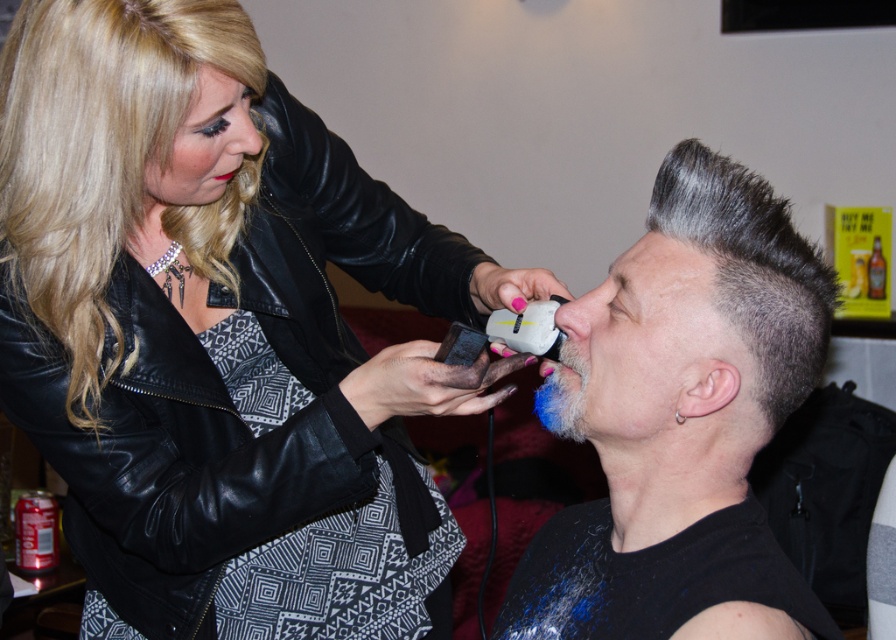
Question: Which object appears farthest from the camera in this image?

Choices:
 (A) pink matte lips at center
 (B) black leather jacket at upper left

Answer: (A)

Question: Is shiny black leather jacket at upper left further to camera compared to gray matte hair at upper right?

Choices:
 (A) yes
 (B) no

Answer: (A)

Question: Which point is closer to the camera?

Choices:
 (A) shiny silver hair at center
 (B) gray matte hair at upper right

Answer: (A)

Question: Which object is positioned closest to the black leather jacket at upper left?

Choices:
 (A) gray matte hair at upper right
 (B) shiny black leather jacket at upper left

Answer: (B)

Question: Does shiny black leather jacket at upper left appear over gray matte hair at upper right?

Choices:
 (A) no
 (B) yes

Answer: (B)

Question: Is blue matte beard at lower center to the left of pink matte lips at center from the viewer's perspective?

Choices:
 (A) yes
 (B) no

Answer: (B)